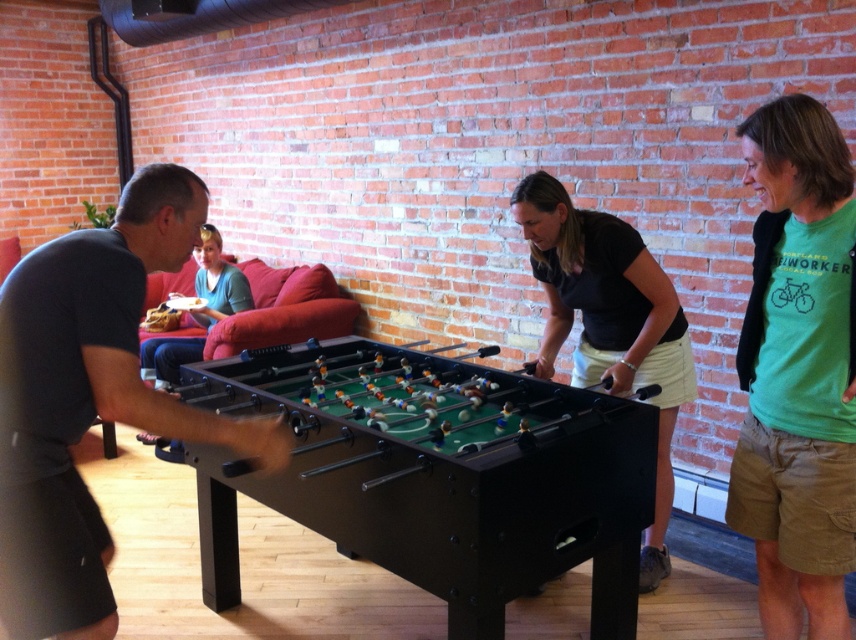
Is black matte shirt at center shorter than blue cotton shirt at upper left?

No.

Is black matte shirt at center taller than blue cotton shirt at upper left?

Correct, black matte shirt at center is much taller as blue cotton shirt at upper left.

Which is in front, point (515, 205) or point (169, 381)?

Point (515, 205)

You are a GUI agent. You are given a task and a screenshot of the screen. Output one action in this format:
    pyautogui.click(x=<x>, y=<y>)
    Task: Click on the black matte shirt at center
    
    Given the screenshot: What is the action you would take?
    pyautogui.click(x=609, y=323)

Which is behind, point (539, 561) or point (3, 410)?

The point (539, 561) is more distant.

Who is shorter, black plastic foosball table at center or dark gray shirt at left?

black plastic foosball table at center

Find the location of `black plastic foosball table at center`. black plastic foosball table at center is located at coordinates (437, 477).

Is dark gray shirt at left closer to camera compared to green cotton t-shirt at center?

Yes, it is in front of green cotton t-shirt at center.

Who is shorter, dark gray shirt at left or green cotton t-shirt at center?

With less height is dark gray shirt at left.

At what (x,y) coordinates should I click in order to perform the action: click on dark gray shirt at left. Please return your answer as a coordinate pair (x, y). Looking at the image, I should click on (88, 400).

The width and height of the screenshot is (856, 640). I want to click on dark gray shirt at left, so click(88, 400).